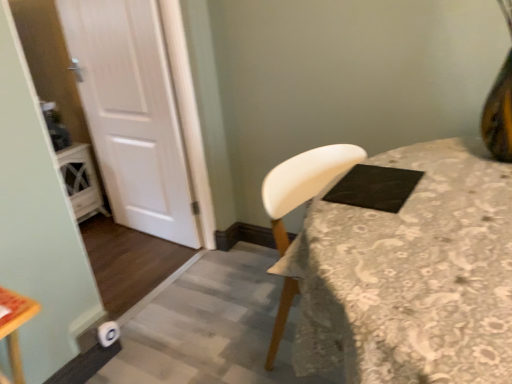
Find the location of a particular element. This screenshot has height=384, width=512. black matte pad at upper right is located at coordinates (374, 187).

What do you see at coordinates (374, 187) in the screenshot? I see `black matte pad at upper right` at bounding box center [374, 187].

At what (x,y) coordinates should I click in order to perform the action: click on white wood door at left. Please return your answer as a coordinate pair (x, y). Looking at the image, I should click on (132, 114).

What do you see at coordinates (132, 114) in the screenshot?
I see `white wood door at left` at bounding box center [132, 114].

This screenshot has height=384, width=512. Find the location of `black matte pad at upper right`. black matte pad at upper right is located at coordinates (374, 187).

What's the angular difference between white wood door at left and black matte pad at upper right's facing directions?

The angle between the facing direction of white wood door at left and the facing direction of black matte pad at upper right is 92.5 degrees.

Which is nearer, (191, 232) or (355, 199)?

The point (355, 199) is closer.

From the image's perspective, which is above, white wood door at left or black matte pad at upper right?

white wood door at left is shown above in the image.

In the scene shown: Which is correct: white wood door at left is inside black matte pad at upper right, or outside of it?

white wood door at left is spatially situated outside black matte pad at upper right.

Is the depth of white fabric-covered table at center less than that of white wood door at left?

Yes, the depth of white fabric-covered table at center is less than that of white wood door at left.

From the image's perspective, would you say white fabric-covered table at center is shown under white wood door at left?

Yes.

Is white fabric-covered table at center with white wood door at left?

No, white fabric-covered table at center is not making contact with white wood door at left.

Considering the sizes of white fabric-covered table at center and white wood door at left in the image, is white fabric-covered table at center bigger or smaller than white wood door at left?

In the image, white fabric-covered table at center appears to be larger than white wood door at left.

Is white wood door at left not within white fabric-covered table at center?

Indeed, white wood door at left is completely outside white fabric-covered table at center.

In terms of width, does white wood door at left look wider or thinner when compared to white fabric-covered table at center?

In the image, white wood door at left appears to be more narrow than white fabric-covered table at center.

I want to click on door positioned vertically above the white fabric-covered table at center (from a real-world perspective), so click(132, 114).

Is white wood door at left directly adjacent to white fabric-covered table at center?

white wood door at left and white fabric-covered table at center are not in contact.

Considering the sizes of objects black matte pad at upper right and white fabric-covered table at center in the image provided, who is shorter, black matte pad at upper right or white fabric-covered table at center?

Standing shorter between the two is black matte pad at upper right.

From the image's perspective, relative to white fabric-covered table at center, is black matte pad at upper right above or below?

Based on their image positions, black matte pad at upper right is located above white fabric-covered table at center.

Does black matte pad at upper right have a lesser width compared to white fabric-covered table at center?

Indeed, black matte pad at upper right has a lesser width compared to white fabric-covered table at center.

Which is more to the right, black matte pad at upper right or white fabric-covered table at center?

From the viewer's perspective, black matte pad at upper right appears more on the right side.

Considering the sizes of objects white fabric-covered table at center and black matte pad at upper right in the image provided, who is bigger, white fabric-covered table at center or black matte pad at upper right?

white fabric-covered table at center.

Which point is more forward, [403,351] or [377,175]?

The point [403,351] is closer.

Could black matte pad at upper right be considered to be inside white fabric-covered table at center?

That's correct, black matte pad at upper right is inside white fabric-covered table at center.

Is black matte pad at upper right at the back of white fabric-covered table at center?

No, white fabric-covered table at center is not facing the opposite direction of black matte pad at upper right.

From the image's perspective, is black matte pad at upper right positioned above or below white wood door at left?

black matte pad at upper right is below white wood door at left.

Image resolution: width=512 pixels, height=384 pixels. What are the coordinates of `pad that appears in front of the white wood door at left` in the screenshot? It's located at (374, 187).

Considering the relative sizes of black matte pad at upper right and white wood door at left in the image provided, is black matte pad at upper right thinner than white wood door at left?

No, black matte pad at upper right is not thinner than white wood door at left.

You are a GUI agent. You are given a task and a screenshot of the screen. Output one action in this format:
    pyautogui.click(x=<x>, y=<y>)
    Task: Click on the door on the left of black matte pad at upper right
    The height and width of the screenshot is (384, 512).
    Given the screenshot: What is the action you would take?
    pyautogui.click(x=132, y=114)

Where is `table that appears below the white wood door at left (from a real-world perspective)`? table that appears below the white wood door at left (from a real-world perspective) is located at coordinates (411, 275).

When comparing their distances from black matte pad at upper right, does white fabric-covered table at center or white wood door at left seem closer?

white fabric-covered table at center.

Looking at the image, which one is located further to white wood door at left, black matte pad at upper right or white fabric-covered table at center?

white fabric-covered table at center lies further to white wood door at left than the other object.

Estimate the real-world distances between objects in this image. Which object is further from white fabric-covered table at center, black matte pad at upper right or white wood door at left?

white wood door at left is further to white fabric-covered table at center.

Looking at the image, which one is located closer to white wood door at left, white fabric-covered table at center or black matte pad at upper right?

The object closer to white wood door at left is black matte pad at upper right.

Considering their positions, is white wood door at left positioned closer to black matte pad at upper right than white fabric-covered table at center?

The object closer to black matte pad at upper right is white fabric-covered table at center.

Based on their spatial positions, is white wood door at left or black matte pad at upper right further from white fabric-covered table at center?

white wood door at left is positioned further to the anchor white fabric-covered table at center.

Where is `table situated between white wood door at left and black matte pad at upper right from left to right`? The height and width of the screenshot is (384, 512). table situated between white wood door at left and black matte pad at upper right from left to right is located at coordinates (411, 275).